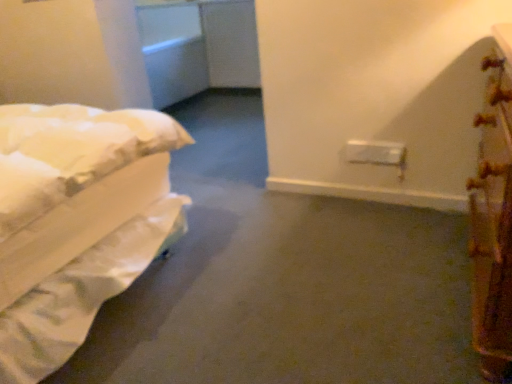
The height and width of the screenshot is (384, 512). In order to click on wooden vanity at right in this screenshot , I will do [493, 217].

Describe the element at coordinates (493, 217) in the screenshot. The width and height of the screenshot is (512, 384). I see `wooden vanity at right` at that location.

What is the approximate width of wooden vanity at right?

wooden vanity at right is 22.97 centimeters wide.

Find the location of a particular element. The width and height of the screenshot is (512, 384). wooden vanity at right is located at coordinates (493, 217).